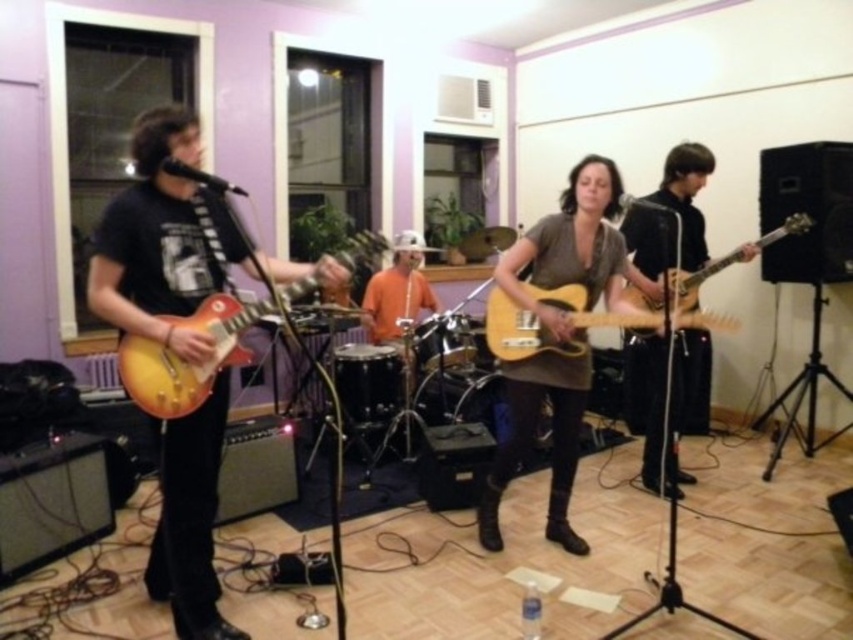
Measure the distance between satin orange guitar at left and camera.

satin orange guitar at left and camera are 2.24 meters apart from each other.

Who is higher up, satin orange guitar at left or matte brown guitar at right?

Positioned higher is satin orange guitar at left.

Who is more distant from viewer, (x=199, y=266) or (x=659, y=340)?

Positioned behind is point (x=659, y=340).

This screenshot has width=853, height=640. In order to click on satin orange guitar at left in this screenshot , I will do `click(163, 240)`.

Is point (160, 176) less distant than point (776, 236)?

Yes, point (160, 176) is in front of point (776, 236).

Can you confirm if satin orange guitar at left is positioned to the right of light brown wood electric guitar at center?

No, satin orange guitar at left is not to the right of light brown wood electric guitar at center.

Image resolution: width=853 pixels, height=640 pixels. Describe the element at coordinates (163, 240) in the screenshot. I see `satin orange guitar at left` at that location.

Find the location of a particular element. Image resolution: width=853 pixels, height=640 pixels. satin orange guitar at left is located at coordinates (163, 240).

Is point (688, 358) positioned before point (683, 275)?

No, (688, 358) is further to viewer.

Who is taller, matte brown guitar at right or light wood electric guitar at center?

matte brown guitar at right

I want to click on matte brown guitar at right, so tap(686, 198).